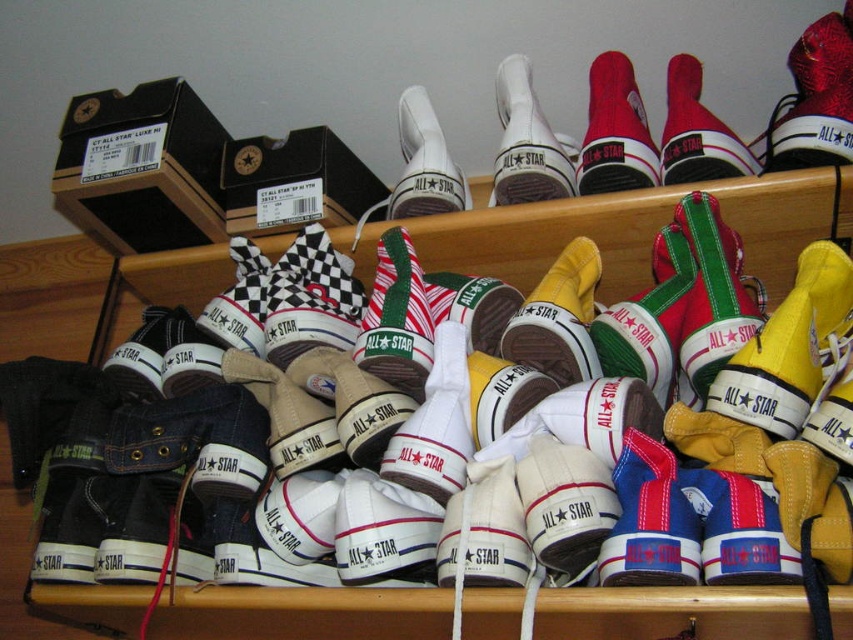
Between point (172, 136) and point (532, 113), which one is positioned behind?

Positioned behind is point (172, 136).

Who is higher up, black cardboard box at upper left or white leather shoe at upper center?

white leather shoe at upper center is higher up.

This screenshot has width=853, height=640. Identify the location of black cardboard box at upper left. (141, 168).

How much distance is there between white canvas shoes at upper center and green canvas sneaker at center?

white canvas shoes at upper center is 12.08 inches away from green canvas sneaker at center.

Is point (375, 616) closer to viewer compared to point (704, 211)?

Yes, it is.

The width and height of the screenshot is (853, 640). I want to click on white canvas shoes at upper center, so click(300, 612).

Who is positioned more to the right, matte black sneaker at upper right or red canvas sneaker at upper right?

matte black sneaker at upper right is more to the right.

Is matte black sneaker at upper right taller than red canvas sneaker at upper right?

Yes, matte black sneaker at upper right is taller than red canvas sneaker at upper right.

Who is more forward, [809,99] or [677,102]?

Point [809,99] is in front.

Locate an element on the screen. The width and height of the screenshot is (853, 640). matte black sneaker at upper right is located at coordinates (815, 99).